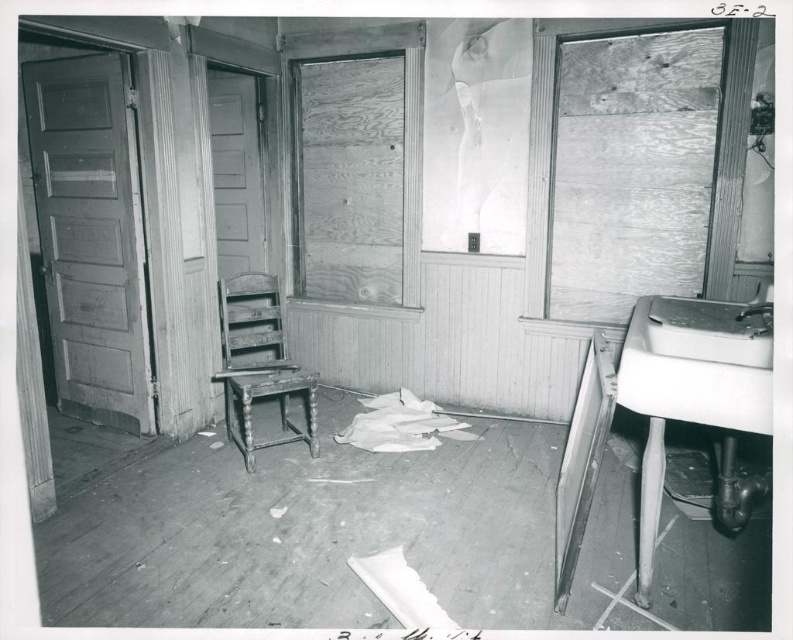
You are a painter who needs to set up an easel that requires at least 1.5 meters of vertical space. You see the wooden chair at center and the white porcelain sink at right. Which object can accommodate your easel based on their height?

The wooden chair at center has a greater height compared to the white porcelain sink at right, so the wooden chair at center can accommodate the easel as it meets the required vertical space of 1.5 meters.

You are standing at the entrance of the room and want to place a new rug exactly where the wooden chair at center is currently located. According to the coordinates provided, what are the coordinates where you should place the rug?

You should place the rug at coordinates point (259, 362) where the wooden chair at center is located.